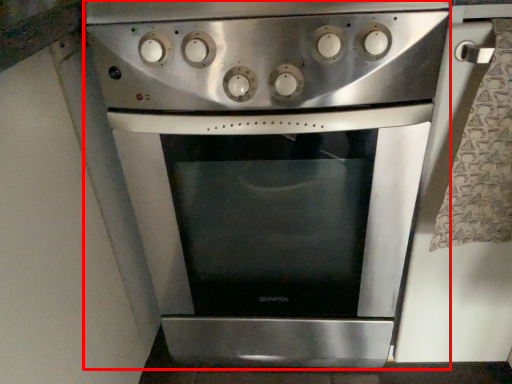
Question: From the image's perspective, where is oven (annotated by the red box) located in relation to gas stove in the image?

Choices:
 (A) above
 (B) below

Answer: (B)